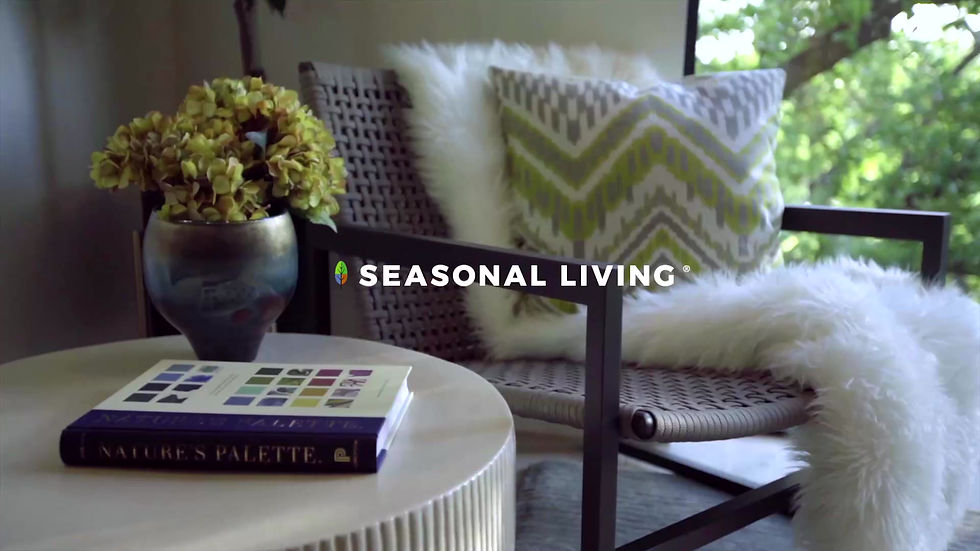
In order to click on edge of table in this screenshot , I will do `click(455, 533)`.